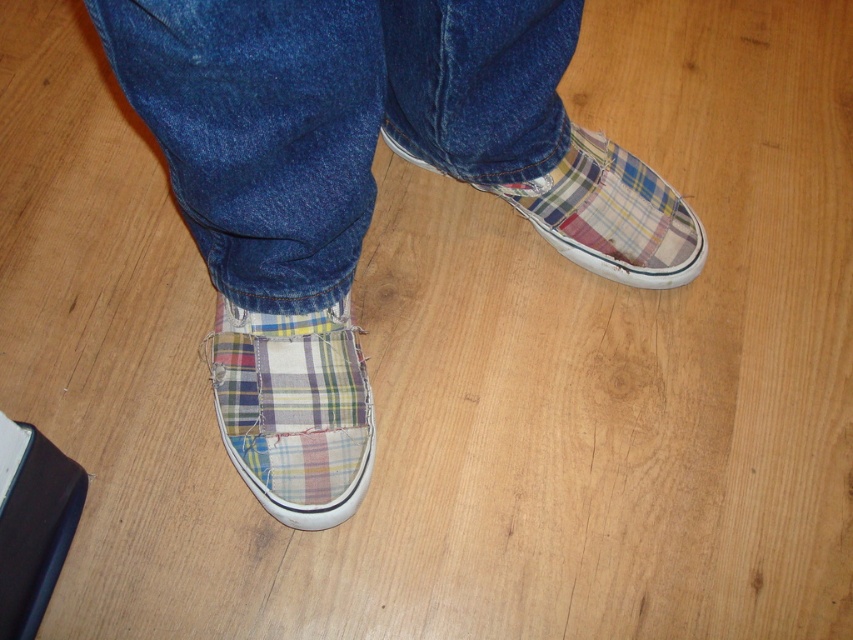
Who is lower down, plaid fabric slip-on shoe at center or plaid fabric slip-on shoe at lower right?

plaid fabric slip-on shoe at center is below.

Which is above, plaid fabric slip-on shoe at center or plaid fabric slip-on shoe at lower right?

plaid fabric slip-on shoe at lower right is above.

Which is behind, point (335, 45) or point (546, 216)?

Positioned behind is point (546, 216).

The image size is (853, 640). In order to click on plaid fabric slip-on shoe at center in this screenshot , I will do `click(360, 188)`.

Which is below, plaid fabric slip-on shoe at center or denim at center?

plaid fabric slip-on shoe at center

Who is higher up, plaid fabric slip-on shoe at center or denim at center?

denim at center

The width and height of the screenshot is (853, 640). What do you see at coordinates (360, 188) in the screenshot? I see `plaid fabric slip-on shoe at center` at bounding box center [360, 188].

Identify the location of plaid fabric slip-on shoe at center. Image resolution: width=853 pixels, height=640 pixels. tap(360, 188).

How far apart are denim at center and plaid fabric slip-on shoe at lower center?

They are 8.49 inches apart.

Does point (274, 51) come in front of point (337, 332)?

Yes, it is in front of point (337, 332).

Identify the location of denim at center. This screenshot has width=853, height=640. click(329, 116).